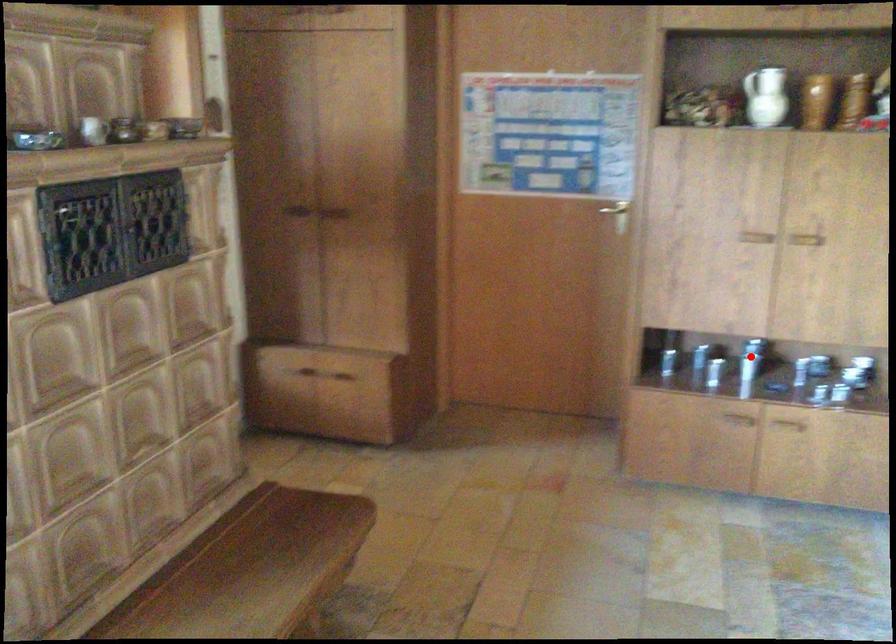
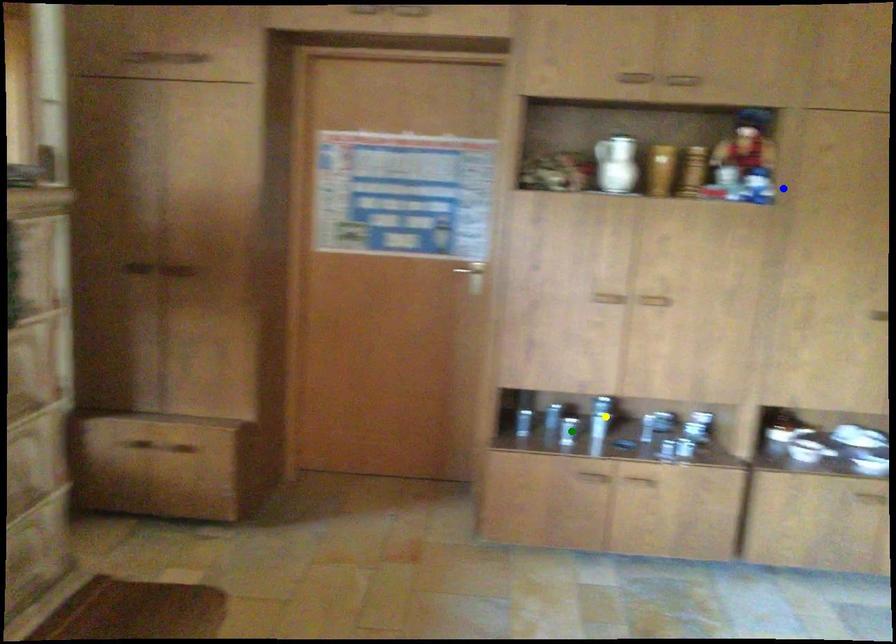
Question: I am providing you with two images of the same scene from different viewpoints. A red point is marked on the first image. You are given multiple points on the second image. Which mark in image 2 goes with the point in image 1?

Choices:
 (A) green point
 (B) yellow point
 (C) blue point

Answer: (B)